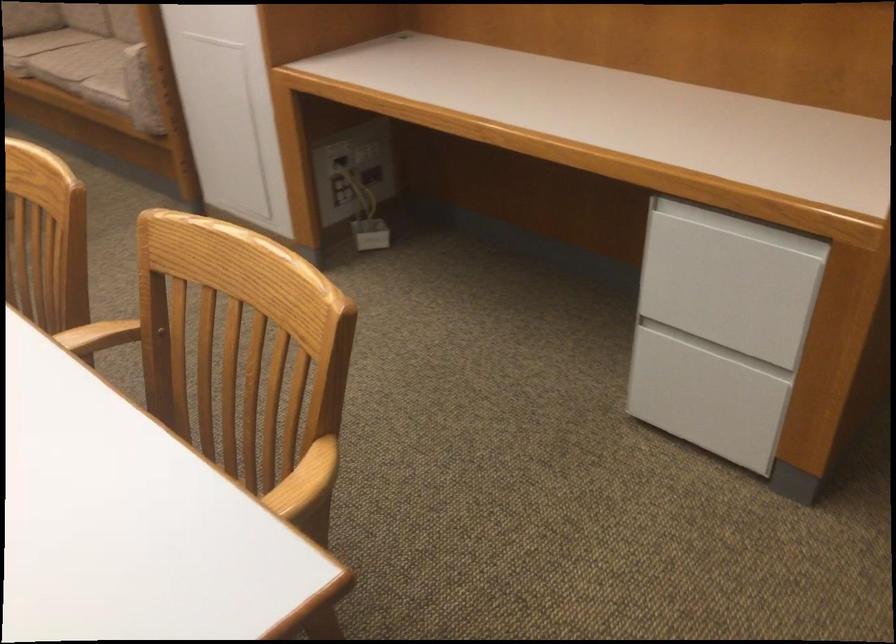
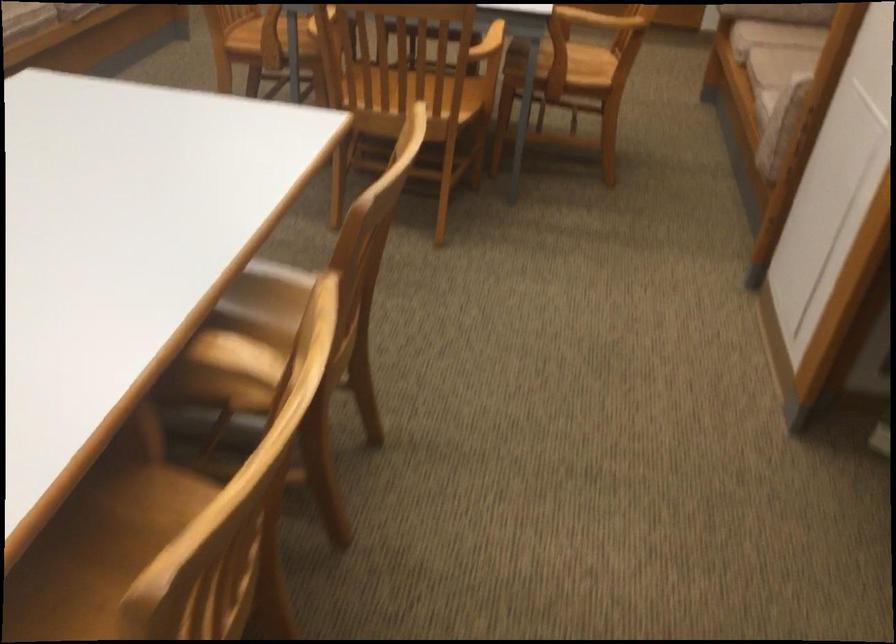
Based on the continuous images, in which direction is the camera rotating?

The rotation direction of the camera is left-down.